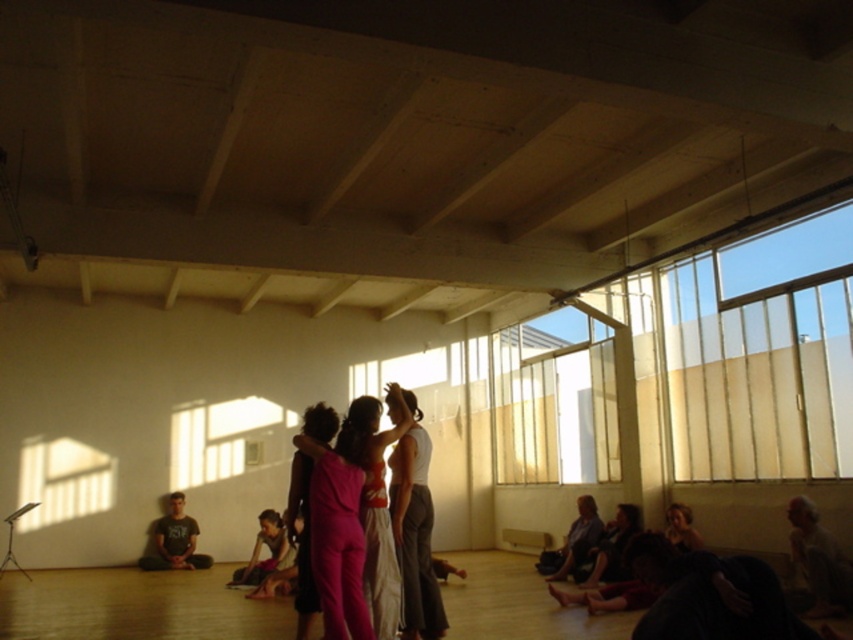
You are a stage designer planning to install a new lighting system in the dance studio. You need to decide where to place a spotlight that can illuminate both the translucent glass window at lower left and the dark purple fabric at lower right without causing glare on either surface. Considering their sizes and positions, which object should you position the spotlight closer to?

The translucent glass window at lower left is smaller than the dark purple fabric at lower right. To avoid glare on both surfaces, the spotlight should be positioned closer to the translucent glass window at lower left since it requires a narrower beam to illuminate effectively, while the larger dark purple fabric at lower right can be lit from a slightly farther distance.